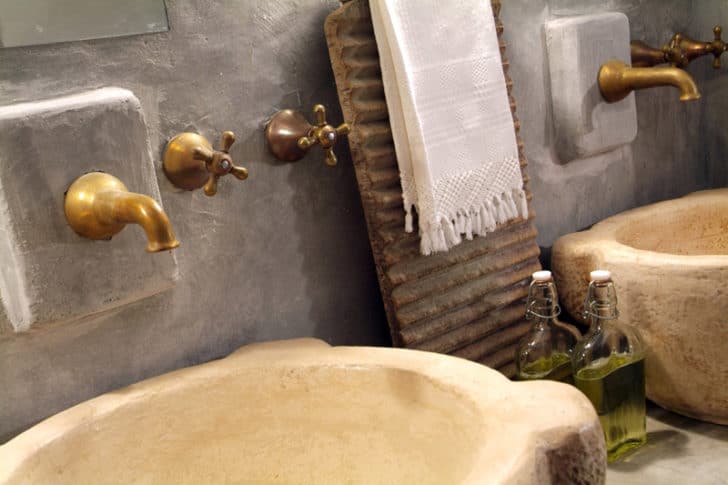
Where is `drying cloth`? drying cloth is located at coordinates (459, 78).